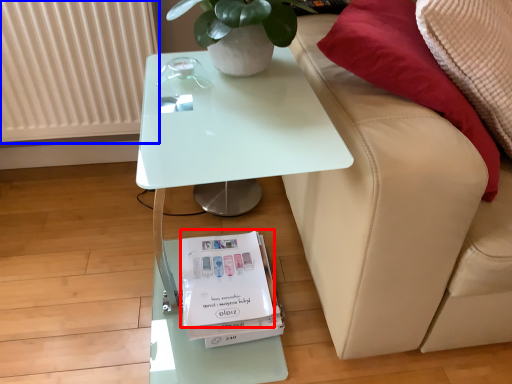
Question: Among these objects, which one is farthest to the camera, magazine (highlighted by a red box) or radiator (highlighted by a blue box)?

Choices:
 (A) magazine
 (B) radiator

Answer: (B)